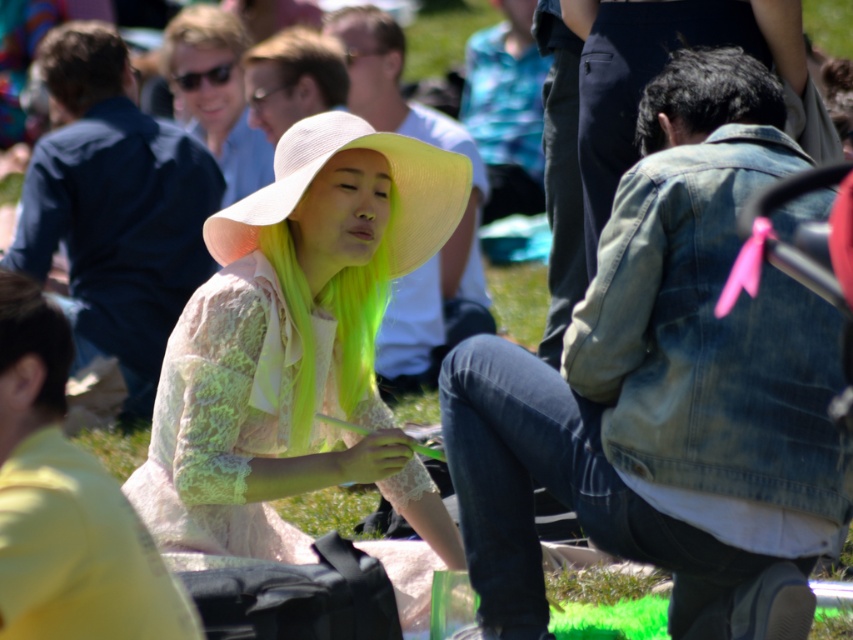
Does point (267, 332) come in front of point (656, 116)?

No, (267, 332) is further to viewer.

Is point (254, 476) farther from viewer compared to point (747, 93)?

Yes, point (254, 476) is farther from viewer.

The image size is (853, 640). What are the coordinates of `light pink lace dress at center` in the screenshot? It's located at (300, 356).

Can you confirm if light yellow straw hat at center is wider than dark brown hair at lower left?

Indeed, light yellow straw hat at center has a greater width compared to dark brown hair at lower left.

Who is positioned more to the right, light yellow straw hat at center or dark brown hair at lower left?

Positioned to the right is light yellow straw hat at center.

This screenshot has height=640, width=853. What are the coordinates of `light yellow straw hat at center` in the screenshot? It's located at (323, 163).

Is the position of dark brown hair at upper left less distant than that of light brown hair at upper center?

Yes, it is.

Is dark brown hair at upper left below light brown hair at upper center?

Indeed, dark brown hair at upper left is positioned under light brown hair at upper center.

The image size is (853, 640). Identify the location of dark brown hair at upper left. (80, 64).